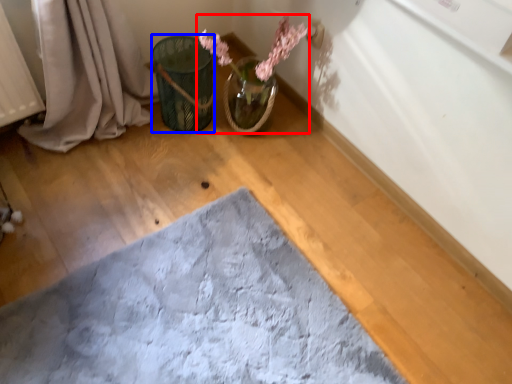
Question: Which point is closer to the camera, floral arrangement (highlighted by a red box) or flower basket (highlighted by a blue box)?

Choices:
 (A) floral arrangement
 (B) flower basket

Answer: (A)